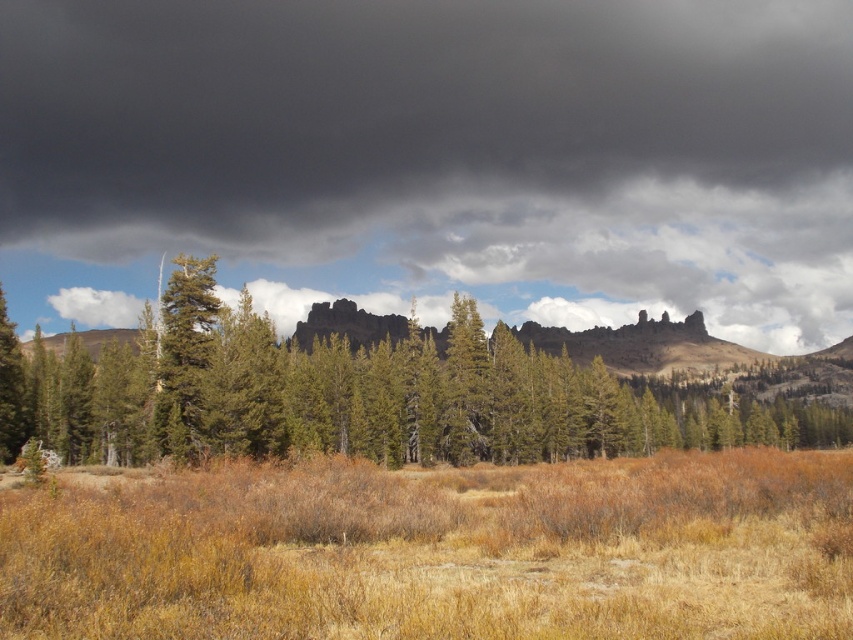
Question: Which object appears closest to the camera in this image?

Choices:
 (A) brown dry grass at center
 (B) dark gray cloud at upper center
 (C) green matte tree at center

Answer: (A)

Question: Does brown dry grass at center have a greater width compared to green matte tree at center?

Choices:
 (A) no
 (B) yes

Answer: (A)

Question: Which object is the closest to the brown dry grass at center?

Choices:
 (A) green matte tree at center
 (B) dark gray cloud at upper center

Answer: (A)

Question: Estimate the real-world distances between objects in this image. Which object is farther from the brown dry grass at center?

Choices:
 (A) green matte tree at center
 (B) dark gray cloud at upper center

Answer: (B)

Question: Is brown dry grass at center thinner than green matte tree at center?

Choices:
 (A) yes
 (B) no

Answer: (A)

Question: Can you confirm if dark gray cloud at upper center is thinner than brown dry grass at center?

Choices:
 (A) yes
 (B) no

Answer: (B)